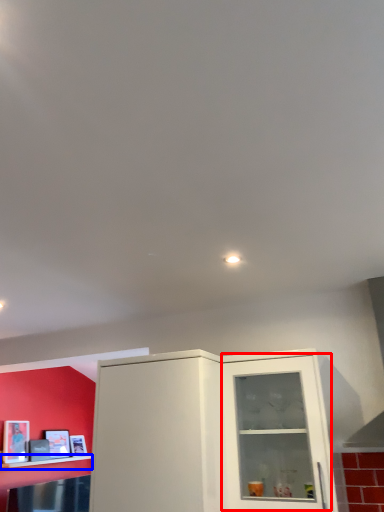
Question: Which object is further to the camera taking this photo, glass door (highlighted by a red box) or shelf (highlighted by a blue box)?

Choices:
 (A) glass door
 (B) shelf

Answer: (B)